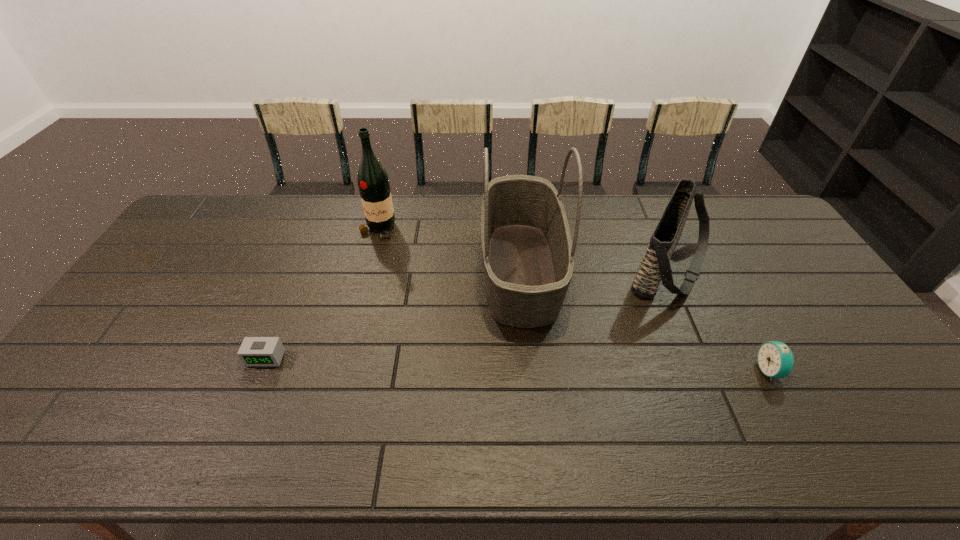
Identify the location of free space between the basket and the second shortest object. (645, 320).

Where is `vacant area that lies between the handbag and the third object from right to left`? vacant area that lies between the handbag and the third object from right to left is located at coordinates (595, 268).

Identify which object is located as the second nearest to the third object from left to right. Please provide its 2D coordinates. Your answer should be formatted as a tuple, i.e. [(x, y)], where the tuple contains the x and y coordinates of a point satisfying the conditions above.

[(373, 182)]

Point out which object is positioned as the third nearest to the third shortest object. Please provide its 2D coordinates. Your answer should be formatted as a tuple, i.e. [(x, y)], where the tuple contains the x and y coordinates of a point satisfying the conditions above.

[(373, 182)]

I want to click on blank space that satisfies the following two spatial constraints: 1. on the back side of the third object from left to right; 2. on the left side of the handbag, so click(520, 267).

Find the location of a particular element. vacant space that satisfies the following two spatial constraints: 1. on the front side of the basket; 2. on the right side of the fourth shortest object is located at coordinates (367, 269).

Locate an element on the screen. This screenshot has height=540, width=960. vacant space that satisfies the following two spatial constraints: 1. on the back side of the basket; 2. on the left side of the handbag is located at coordinates (520, 267).